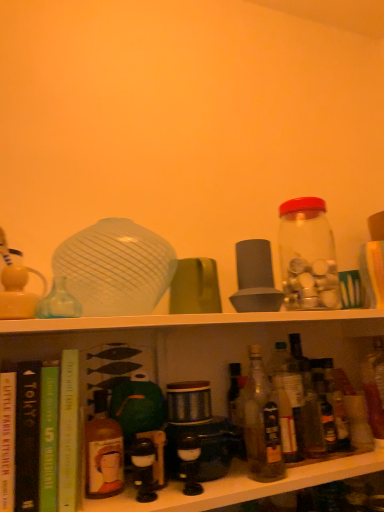
Question: Is point (321, 220) closer or farther from the camera than point (210, 266)?

Choices:
 (A) closer
 (B) farther

Answer: (B)

Question: From their relative heights in the image, would you say transparent glass jar at upper right, the first bottle when ordered from right to left, is taller or shorter than green matte mug at center, which is counted as the 2th tableware, starting from the left?

Choices:
 (A) short
 (B) tall

Answer: (B)

Question: Which of these objects is positioned closest to the transparent glass bottle at left, marked as the first bottle in a left-to-right arrangement?

Choices:
 (A) translucent glass vase at upper center, the second tableware when ordered from right to left
 (B) matte brown glass bottle at center-left, positioned as the second bottle in left-to-right order
 (C) hardcover book at left, which is counted as the 1th book, starting from the left
 (D) green matte mug at center, the first tableware viewed from the right
 (E) hardcover book at center, acting as the fourth book starting from the left

Answer: (A)

Question: Based on their relative distances, which object is nearer to the matte brown glass bottle at center-left, positioned as the second bottle in left-to-right order?

Choices:
 (A) translucent glass vase at upper center, the first tableware from the left
 (B) hardcover book at center, acting as the fourth book starting from the left
 (C) translucent glass bottle at center, acting as the third bottle starting from the right
 (D) translucent glass bottle at center, which appears as the 2th bottle when viewed from the right
 (E) matte white teapot at left

Answer: (B)